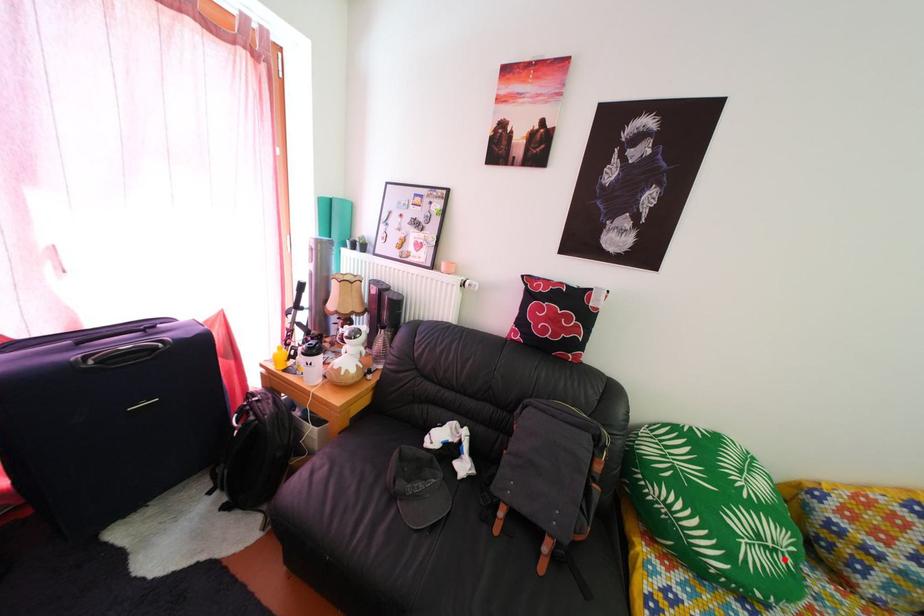
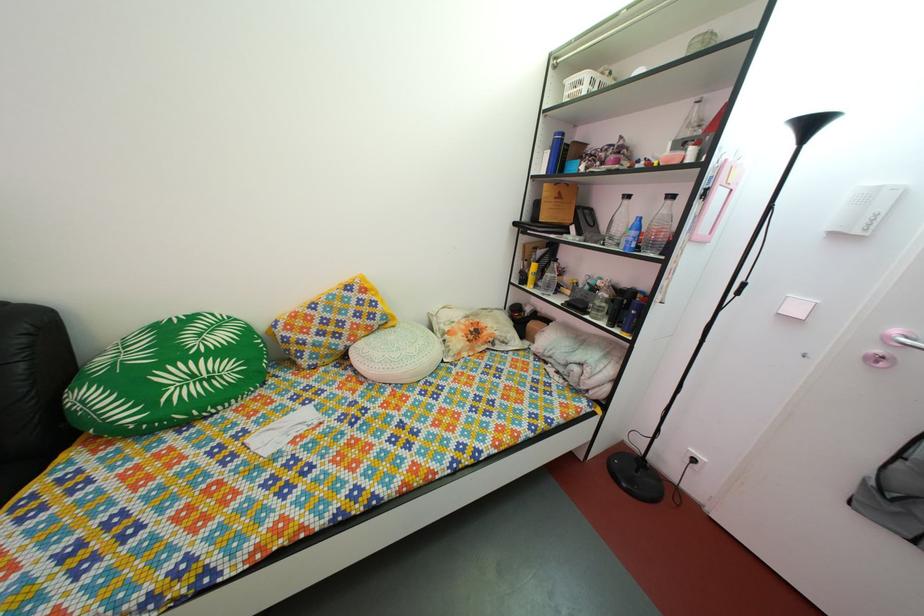
Question: I am providing you with two images of the same scene from different viewpoints. Given a red point in image1, look at the same physical point in image2. Is it:

Choices:
 (A) Closer to the viewpoint
 (B) Farther from the viewpoint

Answer: (B)